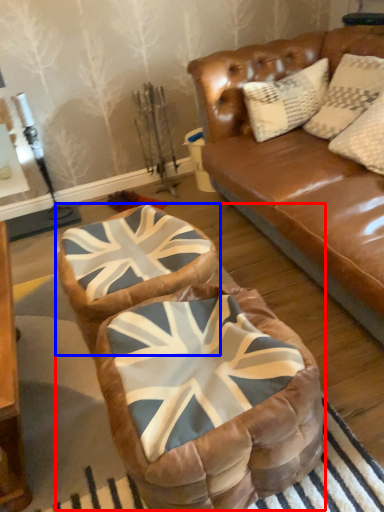
Question: Which point is further to the camera, bean bag chair (highlighted by a red box) or swivel chair (highlighted by a blue box)?

Choices:
 (A) bean bag chair
 (B) swivel chair

Answer: (B)